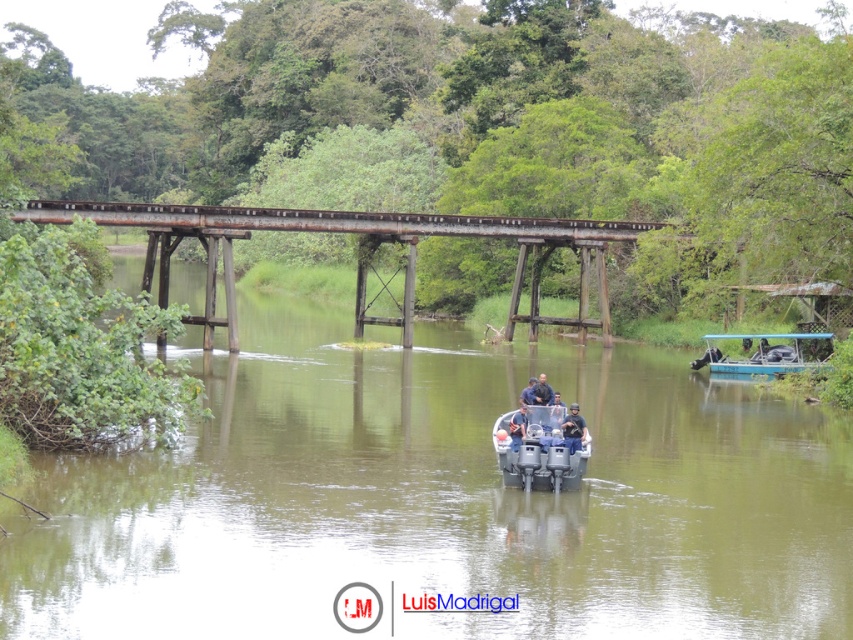
You are a photographer trying to capture a clear shot of the dark blue shirt at center and the black matte helmet at center. Since you want to focus on both subjects, which one should you adjust your camera lens to prioritize in terms of height to ensure both are in frame?

The dark blue shirt at center is not as tall as the black matte helmet at center, so you should adjust your camera lens to prioritize the height of the taller black matte helmet at center to ensure both are in frame.

You are a photographer planning to take a photo of the blue plastic boat at right and the dark blue fabric at center. Which object should you focus on first if you want to capture both in the same frame without adjusting your camera angle?

The blue plastic boat at right is not as tall as the dark blue fabric at center, so you should focus on the blue plastic boat at right first to ensure it is in focus before the taller dark blue fabric at center.

You are a photographer positioned at the camera location. You want to capture a photo of the blue plastic boat at right. Given that your camera has a maximum zoom range of 50 meters, can you clearly capture the boat in your photo?

The blue plastic boat at right and camera are 56.21 meters apart from each other. Since the maximum zoom range of your camera is 50 meters, you cannot clearly capture the boat in your photo.